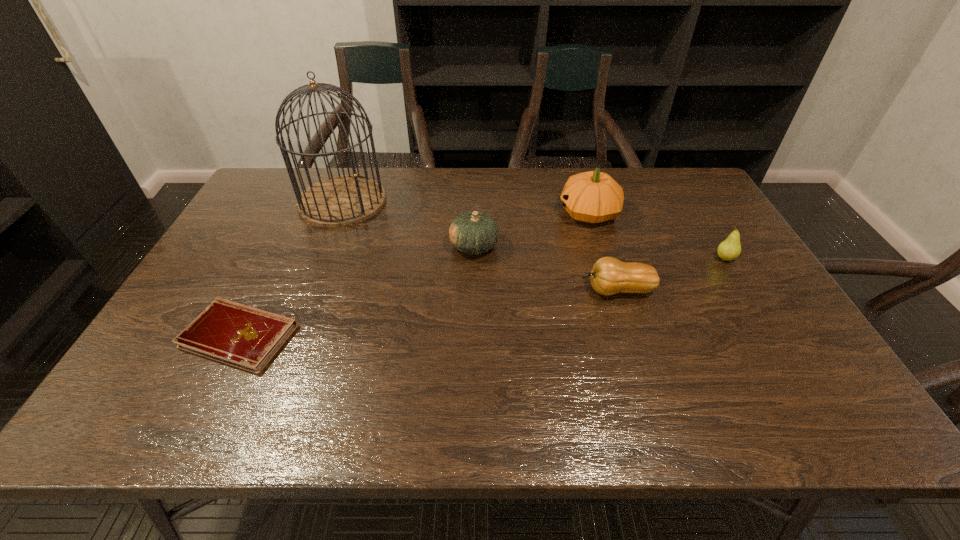
Where is `free space in the image that satisfies the following two spatial constraints: 1. on the back side of the shortest object; 2. on the right side of the pear`? free space in the image that satisfies the following two spatial constraints: 1. on the back side of the shortest object; 2. on the right side of the pear is located at coordinates (277, 259).

Image resolution: width=960 pixels, height=540 pixels. What are the coordinates of `vacant region that satisfies the following two spatial constraints: 1. on the side of the fifth shortest object with the carved face; 2. on the left side of the pear` in the screenshot? It's located at (603, 259).

The height and width of the screenshot is (540, 960). I want to click on free location that satisfies the following two spatial constraints: 1. at the door of the fourth object from right to left; 2. on the left side of the tallest object, so click(324, 246).

At what (x,y) coordinates should I click in order to perform the action: click on vacant space that satisfies the following two spatial constraints: 1. on the front side of the leftmost gourd; 2. on the right side of the rightmost object. Please return your answer as a coordinate pair (x, y). The height and width of the screenshot is (540, 960). Looking at the image, I should click on (473, 259).

Find the location of a particular element. The height and width of the screenshot is (540, 960). vacant space that satisfies the following two spatial constraints: 1. on the side of the fifth shortest object with the carved face; 2. on the left side of the rightmost object is located at coordinates (603, 259).

Where is `vacant area in the image that satisfies the following two spatial constraints: 1. on the front side of the rightmost object; 2. on the stem side of the nearest gourd`? vacant area in the image that satisfies the following two spatial constraints: 1. on the front side of the rightmost object; 2. on the stem side of the nearest gourd is located at coordinates (744, 290).